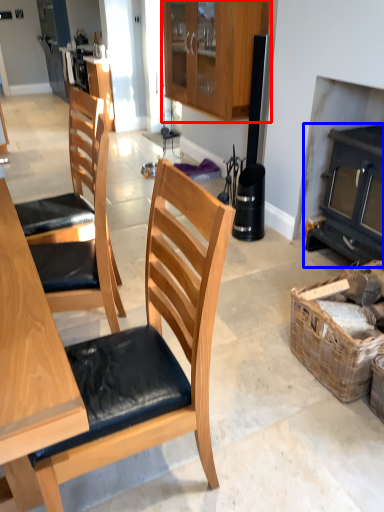
Question: Which of the following is the closest to the observer, cabinetry (highlighted by a red box) or fireplace (highlighted by a blue box)?

Choices:
 (A) cabinetry
 (B) fireplace

Answer: (B)